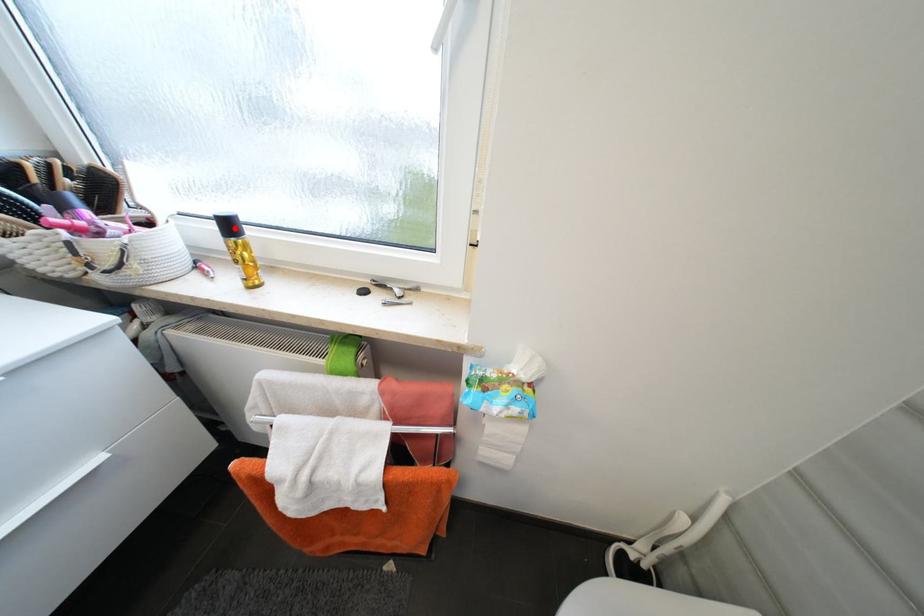
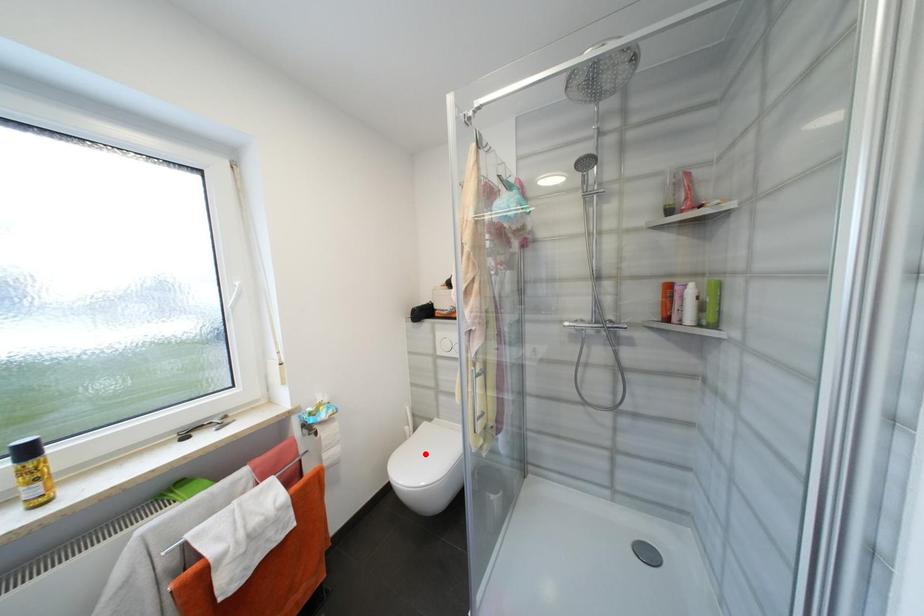
I am providing you with two images of the same scene from different viewpoints. A red point is marked on the first image and another point is marked on the second image. Does the point marked in image1 correspond to the same location as the one in image2?

No